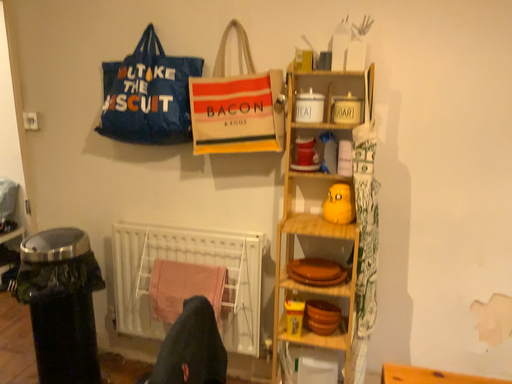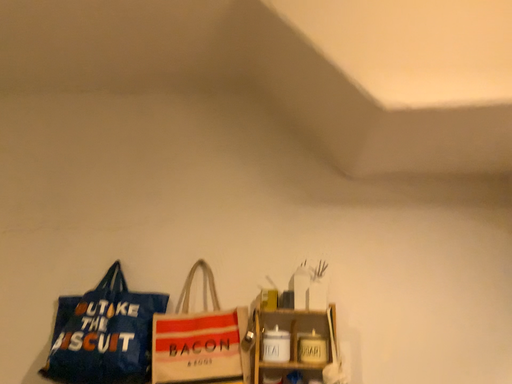
Question: Which way did the camera rotate in the video?

Choices:
 (A) rotated upward
 (B) rotated downward

Answer: (A)